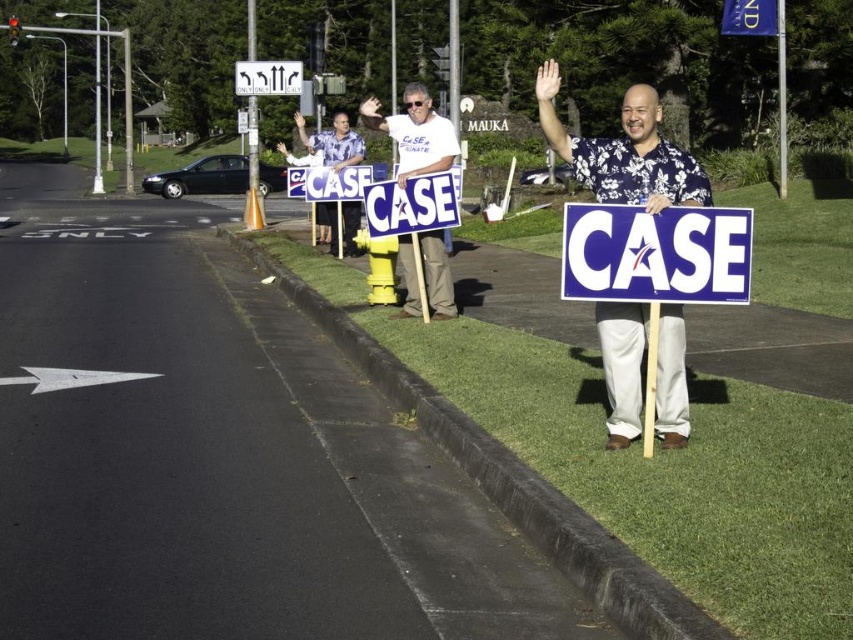
Question: Where is blue floral shirt at center located in relation to white plastic sign at upper center in the image?

Choices:
 (A) below
 (B) above

Answer: (A)

Question: Can you confirm if white plastic sign at center is positioned to the right of blue plastic sign at center?

Choices:
 (A) no
 (B) yes

Answer: (B)

Question: Considering the real-world distances, which object is closest to the blue plastic sign at center?

Choices:
 (A) white plastic sign at center
 (B) matte floral shirt at center
 (C) white plastic sign at upper center

Answer: (A)

Question: Which object is closer to the camera taking this photo?

Choices:
 (A) white cotton shirt at center
 (B) matte floral shirt at center
 (C) blue plastic sign at center

Answer: (A)

Question: Does blue floral shirt at center appear on the left side of white plastic sign at upper center?

Choices:
 (A) yes
 (B) no

Answer: (B)

Question: Among these objects, which one is nearest to the camera?

Choices:
 (A) white plastic sign at center
 (B) blue floral shirt at center

Answer: (A)